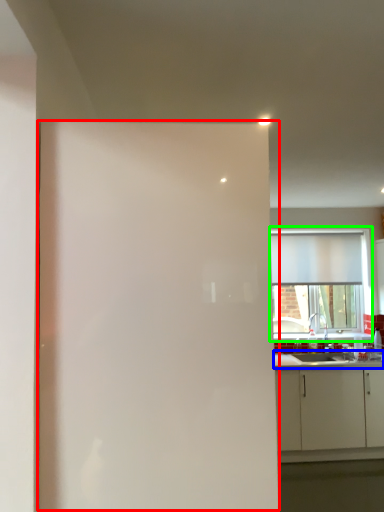
Question: Estimate the real-world distances between objects in this image. Which object is closer to screen door (highlighted by a red box), countertop (highlighted by a blue box) or window (highlighted by a green box)?

Choices:
 (A) countertop
 (B) window

Answer: (A)